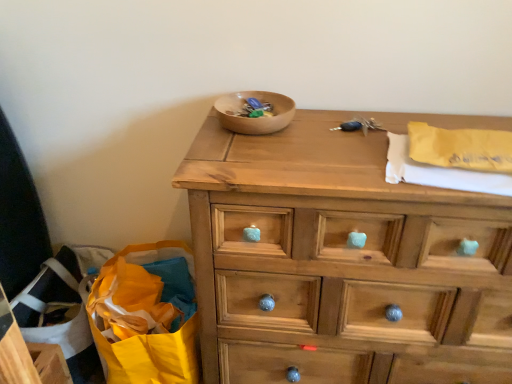
Question: From the image's perspective, does wooden bowl at center appear lower than wooden chest of drawers at center?

Choices:
 (A) yes
 (B) no

Answer: (B)

Question: Is wooden bowl at center smaller than wooden chest of drawers at center?

Choices:
 (A) no
 (B) yes

Answer: (B)

Question: Is wooden bowl at center further to camera compared to wooden chest of drawers at center?

Choices:
 (A) yes
 (B) no

Answer: (A)

Question: From a real-world perspective, is wooden bowl at center beneath wooden chest of drawers at center?

Choices:
 (A) yes
 (B) no

Answer: (B)

Question: Does wooden bowl at center have a lesser width compared to wooden chest of drawers at center?

Choices:
 (A) yes
 (B) no

Answer: (A)

Question: Does point (495, 180) appear closer or farther from the camera than point (290, 117)?

Choices:
 (A) closer
 (B) farther

Answer: (A)

Question: Considering the positions of yellow paper at upper right and wooden bowl at center in the image, is yellow paper at upper right wider or thinner than wooden bowl at center?

Choices:
 (A) thin
 (B) wide

Answer: (B)

Question: Is yellow paper at upper right in front of or behind wooden bowl at center in the image?

Choices:
 (A) front
 (B) behind

Answer: (A)

Question: From the image's perspective, relative to wooden bowl at center, is yellow paper at upper right above or below?

Choices:
 (A) below
 (B) above

Answer: (A)

Question: Considering their positions, is yellow paper bag at lower left located in front of or behind wooden chest of drawers at center?

Choices:
 (A) behind
 (B) front

Answer: (A)

Question: From a real-world perspective, is yellow paper bag at lower left positioned above or below wooden chest of drawers at center?

Choices:
 (A) above
 (B) below

Answer: (B)

Question: Considering the positions of yellow paper bag at lower left and wooden chest of drawers at center in the image, is yellow paper bag at lower left taller or shorter than wooden chest of drawers at center?

Choices:
 (A) tall
 (B) short

Answer: (B)

Question: From the image's perspective, is yellow paper bag at lower left positioned above or below wooden chest of drawers at center?

Choices:
 (A) above
 (B) below

Answer: (B)

Question: Would you say wooden bowl at center is to the left or to the right of wooden chest of drawers at center in the picture?

Choices:
 (A) left
 (B) right

Answer: (A)

Question: Is wooden bowl at center situated inside wooden chest of drawers at center or outside?

Choices:
 (A) inside
 (B) outside

Answer: (B)